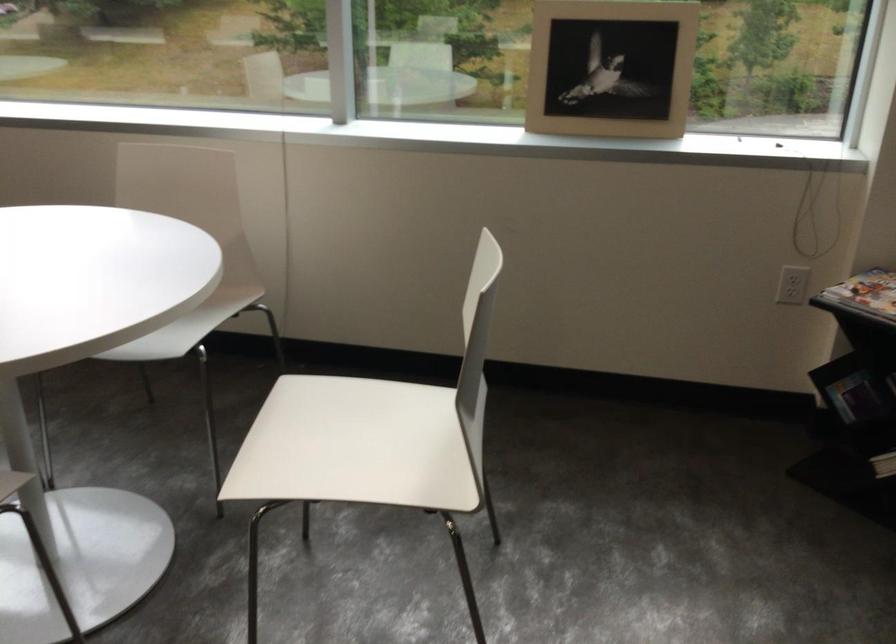
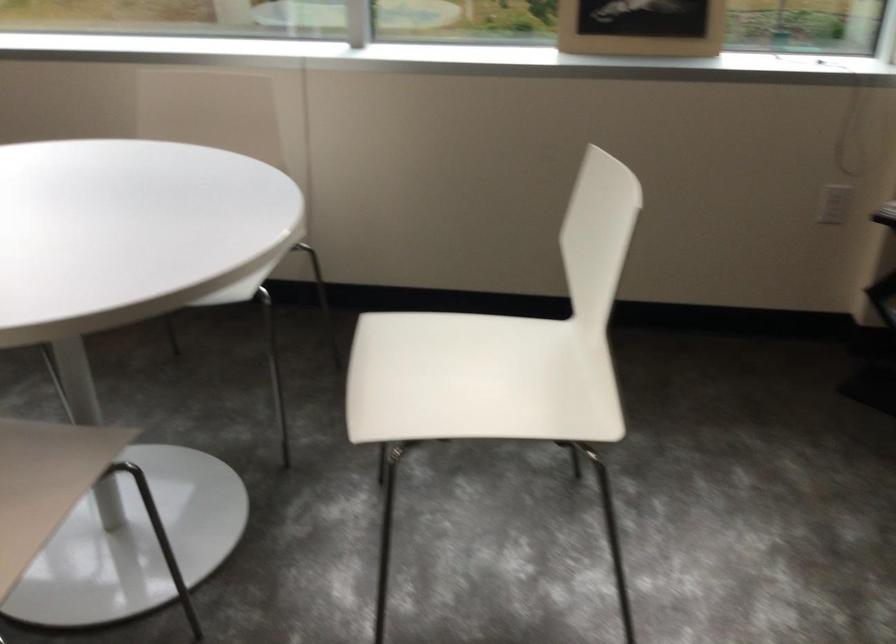
Question: What movement of the cameraman would produce the second image?

Choices:
 (A) Left
 (B) Right
 (C) Forward
 (D) Backward

Answer: (A)